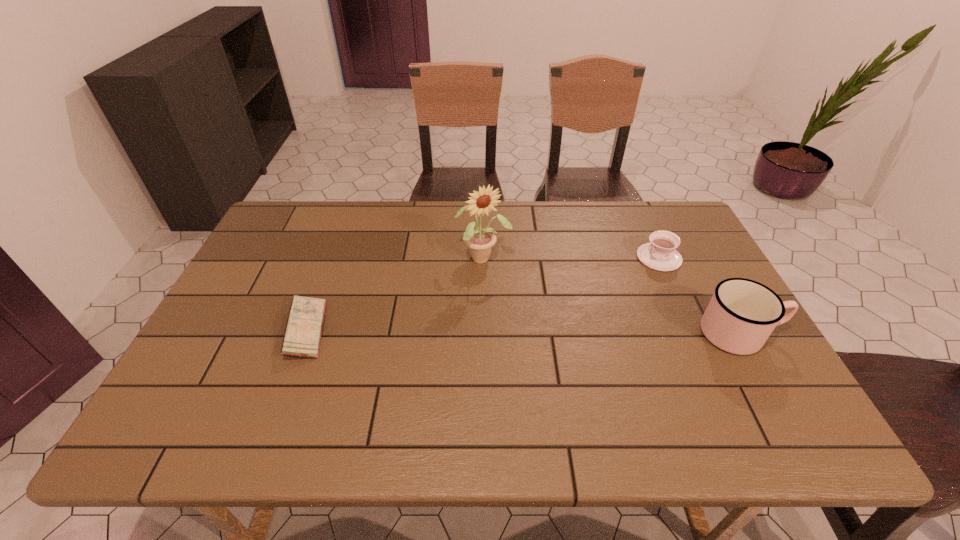
Where is `free space on the desktop that is between the leftmost object and the mug and is positioned on the front-facing side of the sunflower`? The height and width of the screenshot is (540, 960). free space on the desktop that is between the leftmost object and the mug and is positioned on the front-facing side of the sunflower is located at coordinates (525, 332).

Identify the location of vacant space on the desktop that is between the diary and the third shortest object and is positioned on the handle side of the teacup. This screenshot has height=540, width=960. (522, 332).